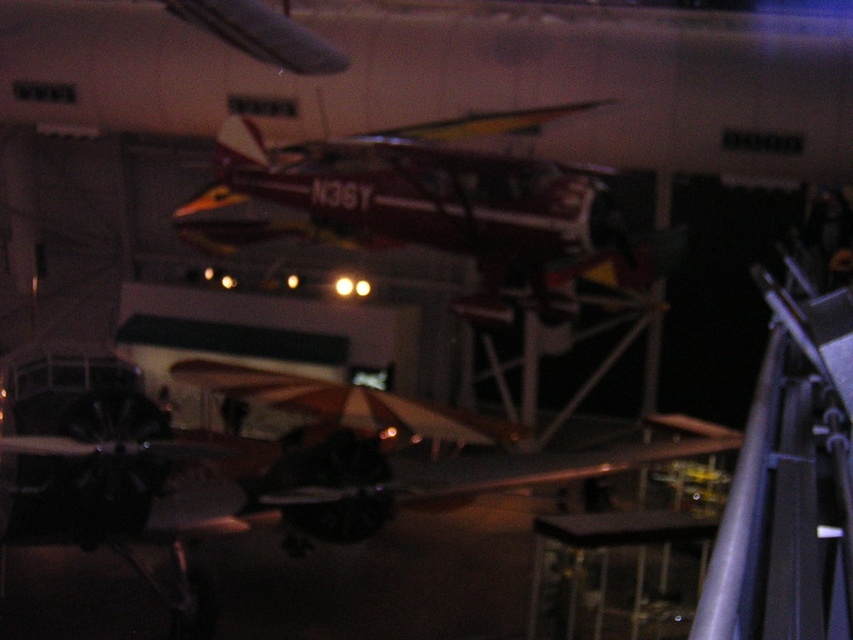
Question: Can you confirm if shiny silver airplane at center is wider than shiny metallic airplane at center?

Choices:
 (A) no
 (B) yes

Answer: (B)

Question: In this image, where is shiny silver airplane at center located relative to shiny metallic airplane at center?

Choices:
 (A) above
 (B) below

Answer: (B)

Question: Which point is closer to the camera taking this photo?

Choices:
 (A) (489, 298)
 (B) (206, 508)

Answer: (B)

Question: Which object is closer to the camera taking this photo?

Choices:
 (A) shiny metallic airplane at center
 (B) shiny silver airplane at center

Answer: (B)

Question: Which of the following is the farthest from the observer?

Choices:
 (A) shiny metallic airplane at center
 (B) shiny silver airplane at center

Answer: (A)

Question: Is shiny silver airplane at center below shiny metallic airplane at center?

Choices:
 (A) yes
 (B) no

Answer: (A)